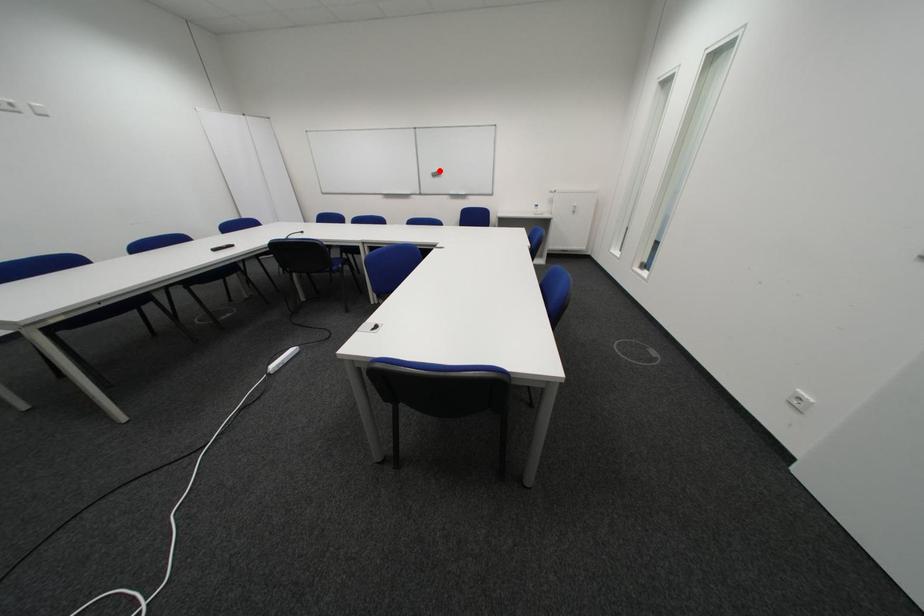
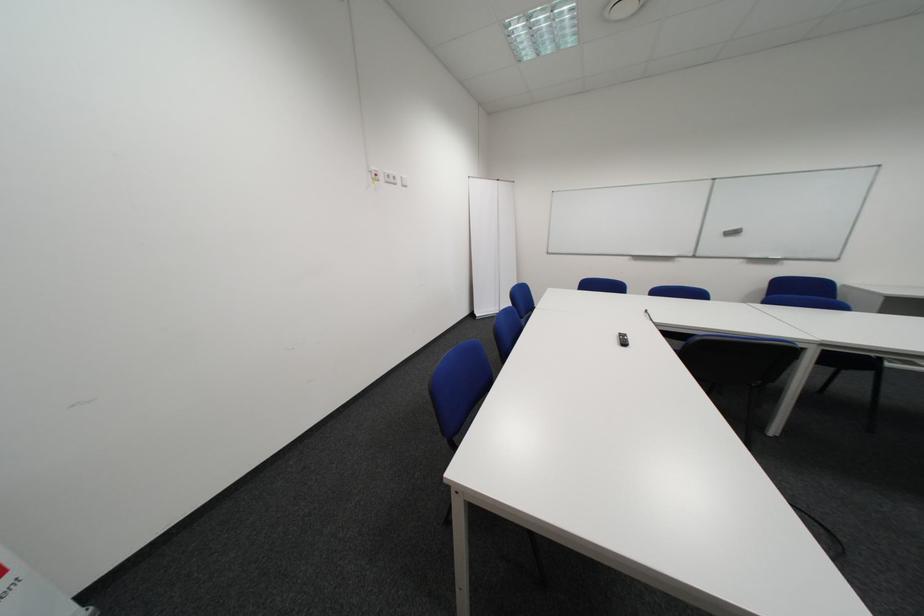
Question: I am providing you with two images of the same scene from different viewpoints. Image1 has a red point marked. In image2, the corresponding 3D location appears at what relative position? Reply with the corresponding letter.

Choices:
 (A) Closer
 (B) Farther

Answer: (B)